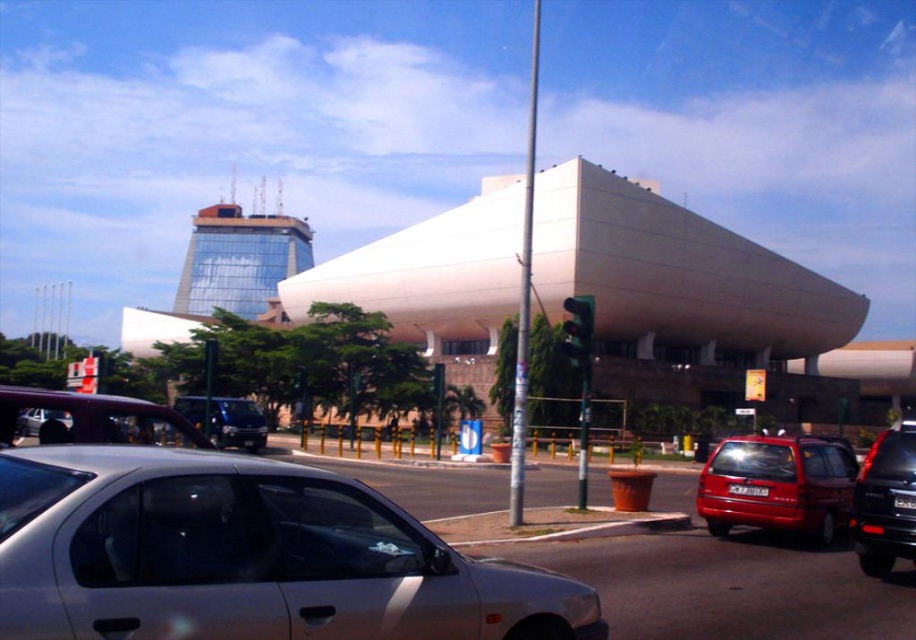
Is point (516, 573) less distant than point (238, 440)?

Yes, point (516, 573) is in front of point (238, 440).

Describe the element at coordinates (246, 556) in the screenshot. I see `satin silver sedan at lower left` at that location.

Locate an element on the screen. This screenshot has width=916, height=640. satin silver sedan at lower left is located at coordinates (246, 556).

Can you confirm if satin silver sedan at lower left is smaller than metallic red station wagon at lower right?

Yes.

Who is positioned more to the right, satin silver sedan at lower left or metallic red station wagon at lower right?

From the viewer's perspective, metallic red station wagon at lower right appears more on the right side.

Who is more forward, (x=158, y=509) or (x=773, y=454)?

Positioned in front is point (x=158, y=509).

Locate an element on the screen. satin silver sedan at lower left is located at coordinates (246, 556).

Does black glossy suv at lower right have a lesser width compared to black glass traffic light at center?

Yes, black glossy suv at lower right is thinner than black glass traffic light at center.

Find the location of a particular element. black glossy suv at lower right is located at coordinates click(885, 502).